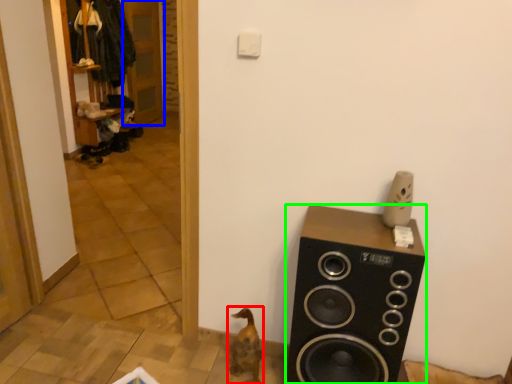
Question: Based on their relative distances, which object is farther from animal (highlighted by a red box)? Choose from door (highlighted by a blue box) and speaker (highlighted by a green box).

Choices:
 (A) door
 (B) speaker

Answer: (A)